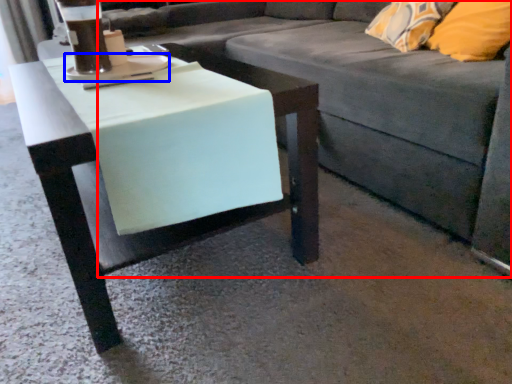
Question: Which point is further to the camera, studio couch (highlighted by a red box) or saucer (highlighted by a blue box)?

Choices:
 (A) studio couch
 (B) saucer

Answer: (B)